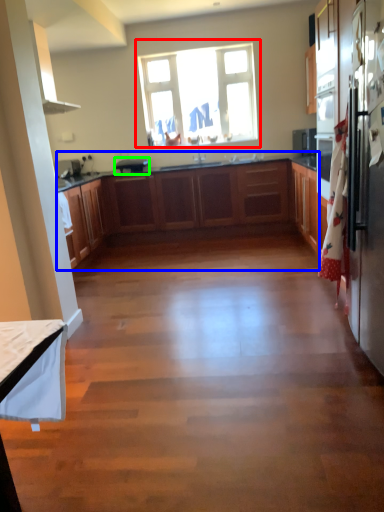
Question: Based on their relative distances, which object is farther from window (highlighted by a red box)? Choose from cabinetry (highlighted by a blue box) and appliance (highlighted by a green box).

Choices:
 (A) cabinetry
 (B) appliance

Answer: (A)